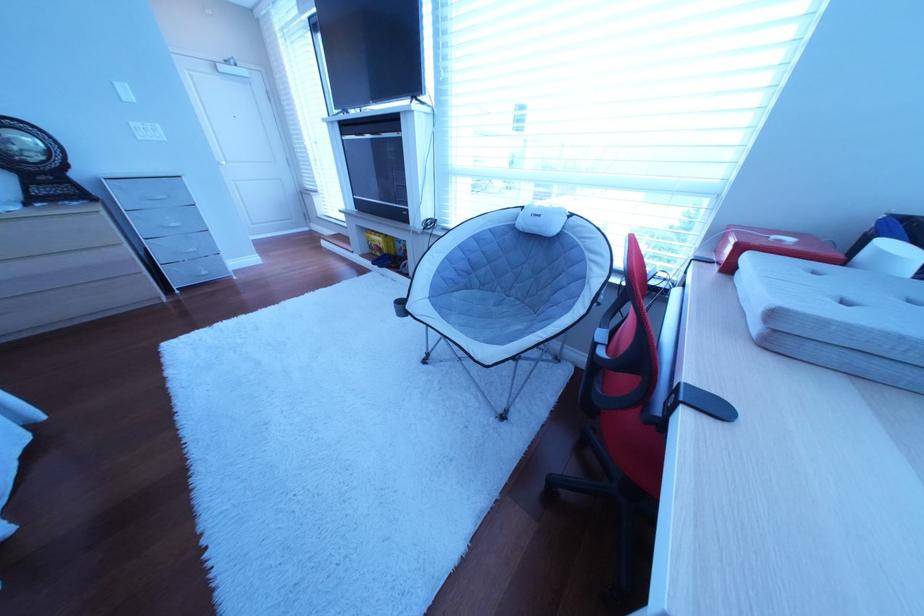
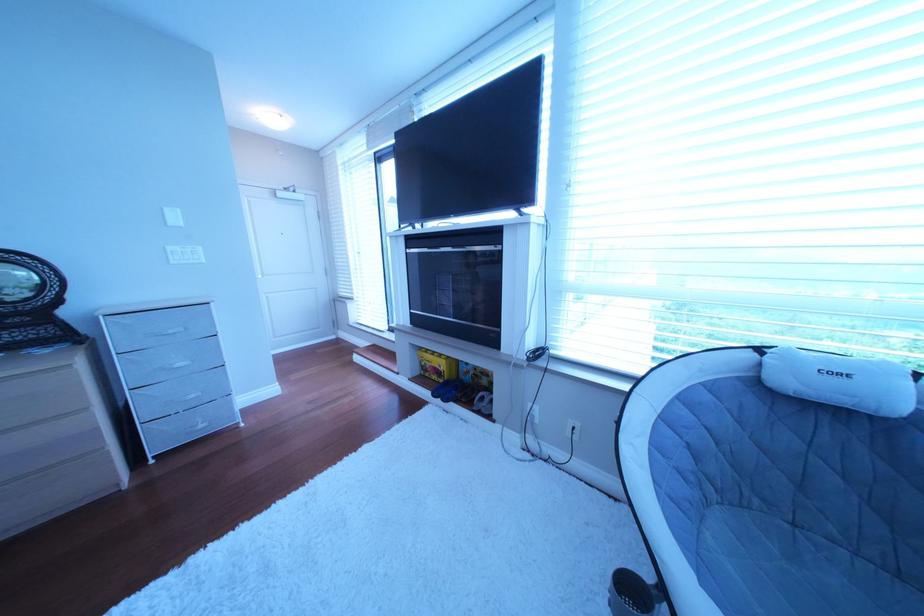
The point at (388, 246) is marked in the first image. Where is the corresponding point in the second image?

(444, 367)